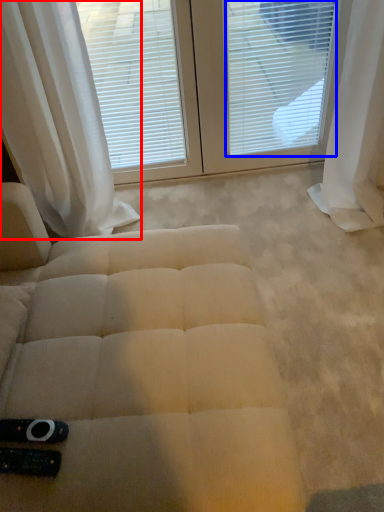
Question: Which of the following is the closest to the observer, curtain (highlighted by a red box) or blind (highlighted by a blue box)?

Choices:
 (A) curtain
 (B) blind

Answer: (A)